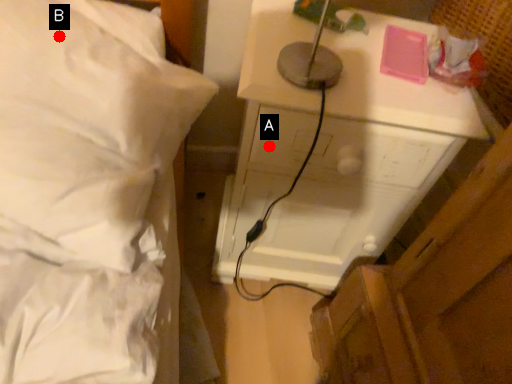
Question: Two points are circled on the image, labeled by A and B beside each circle. Which point appears farthest from the camera in this image?

Choices:
 (A) A is further
 (B) B is further

Answer: (A)